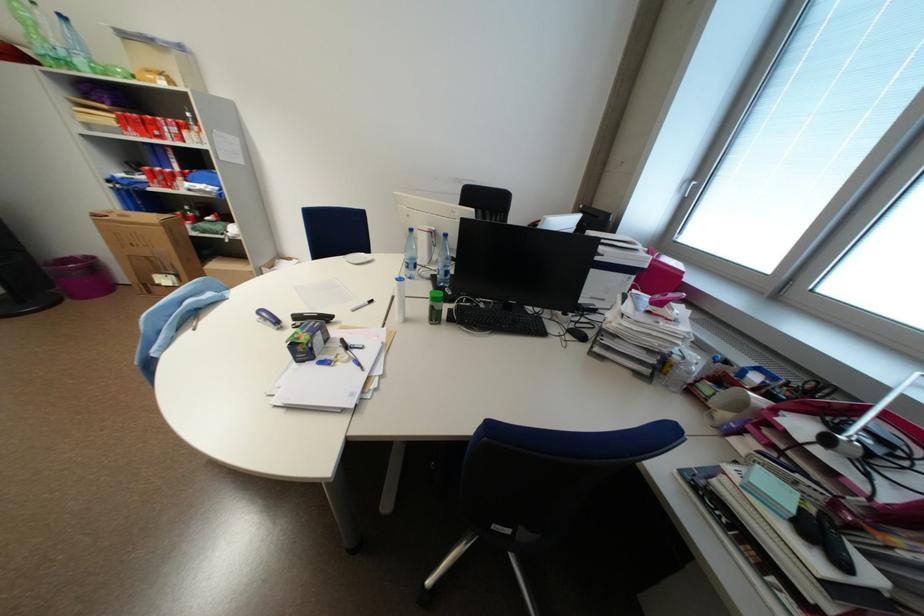
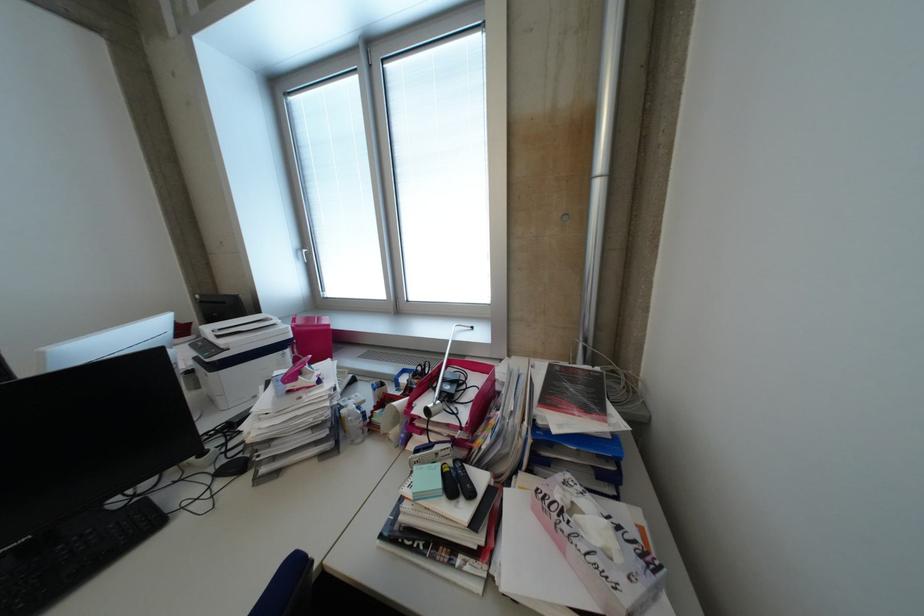
The point at (695,185) is marked in the first image. Where is the corresponding point in the second image?

(309, 254)